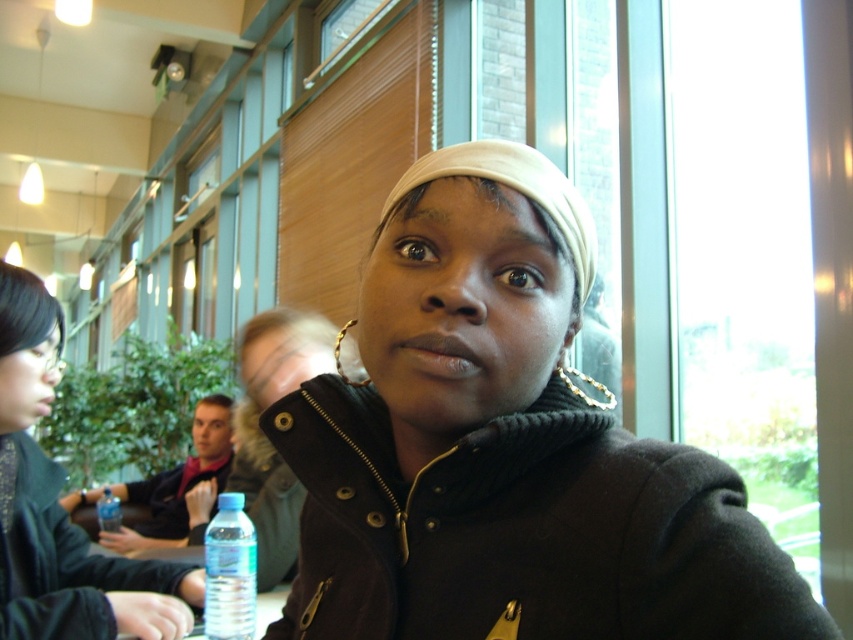
You are a person sitting at a table in a cafe. You want to reach for the transparent plastic bottle at lower center without moving your chair. Can you do it comfortably?

The transparent plastic bottle at lower center is 3.72 feet away from you, which is a comfortable distance to reach without moving your chair.

You are a delivery person who needs to place a small package on the table in the image. The package requires a space at least 2 meters away from the camera to avoid blocking the view. Can the blue plastic water bottle at lower left be moved to make space?

The blue plastic water bottle at lower left is 2.15 meters away from the camera. Since the required distance is at least 2 meters, moving it would allow placing the package there without blocking the view.

Please provide the coordinates of the black woolen coat at center in the image. The coordinate system is normalized, with the origin at the bottom left corner of the image. The x and y axes are measured in fractions of the image width and height respectively. The coordinates should be given as a tuple of two decimal numbers rounded to three decimal places.

The coordinates of the black woolen coat at center are at point (505, 449).